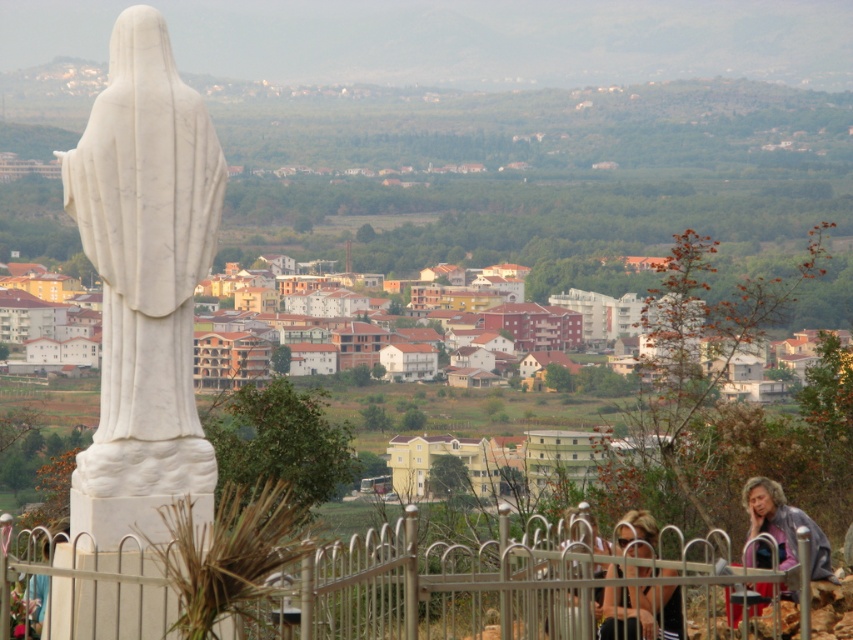
Question: Which point appears closest to the camera in this image?

Choices:
 (A) (647, 563)
 (B) (820, 577)

Answer: (A)

Question: Estimate the real-world distances between objects in this image. Which object is closer to the metallic silver fence at lower center?

Choices:
 (A) white marble statue at left
 (B) gray fabric jacket at lower right
 (C) black fabric dress at lower right

Answer: (C)

Question: In this image, where is white marble statue at left located relative to black fabric dress at lower right?

Choices:
 (A) right
 (B) left

Answer: (B)

Question: Does black fabric dress at lower right lie in front of gray fabric jacket at lower right?

Choices:
 (A) yes
 (B) no

Answer: (A)

Question: From the image, what is the correct spatial relationship of metallic silver fence at lower center in relation to white marble statue at left?

Choices:
 (A) right
 (B) left

Answer: (A)

Question: Which point is farther to the camera?

Choices:
 (A) white marble statue at left
 (B) gray fabric jacket at lower right
 (C) black fabric dress at lower right

Answer: (B)